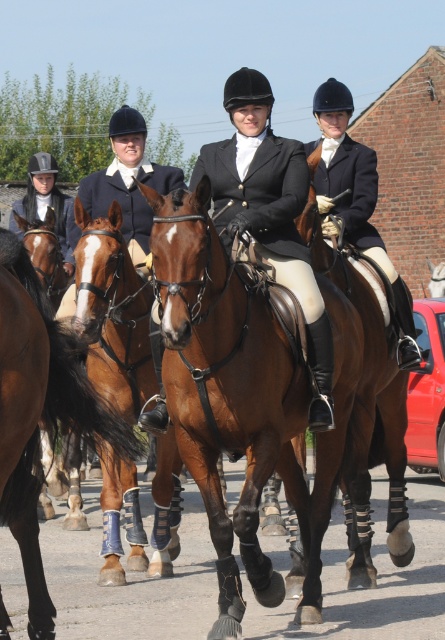
Question: Which object is the farthest from the matte black jacket at center?

Choices:
 (A) black leather jacket at center
 (B) brown glossy horse at center

Answer: (B)

Question: Considering the relative positions of brown glossy horse at center and black leather jacket at center in the image provided, where is brown glossy horse at center located with respect to black leather jacket at center?

Choices:
 (A) right
 (B) left

Answer: (A)

Question: Is black leather jacket at center bigger than matte black jacket at center?

Choices:
 (A) no
 (B) yes

Answer: (B)

Question: Which object is farther from the camera taking this photo?

Choices:
 (A) brown glossy horse at center
 (B) matte black jacket at center
 (C) black leather jacket at center

Answer: (B)

Question: Is black leather jacket at center closer to camera compared to matte black jacket at center?

Choices:
 (A) no
 (B) yes

Answer: (B)

Question: Estimate the real-world distances between objects in this image. Which object is farther from the matte black jacket at center?

Choices:
 (A) brown glossy horse at center
 (B) black leather jacket at center

Answer: (A)